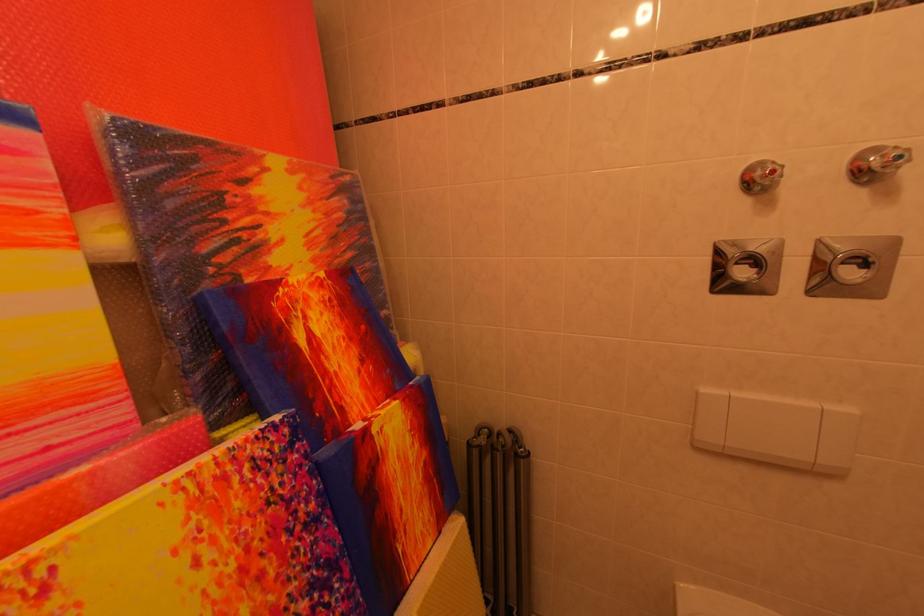
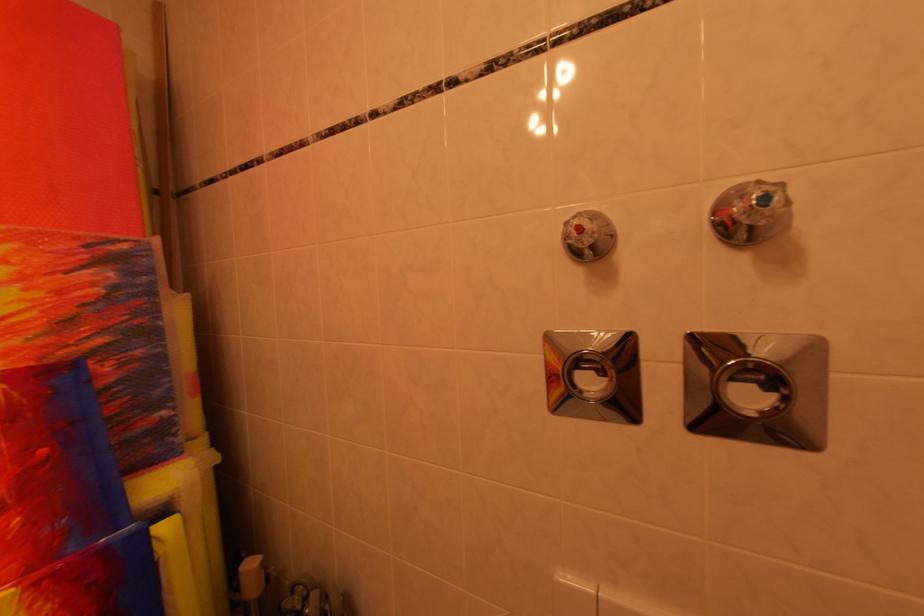
Where in the second image is the point corresponding to (782,176) from the first image?

(589, 232)